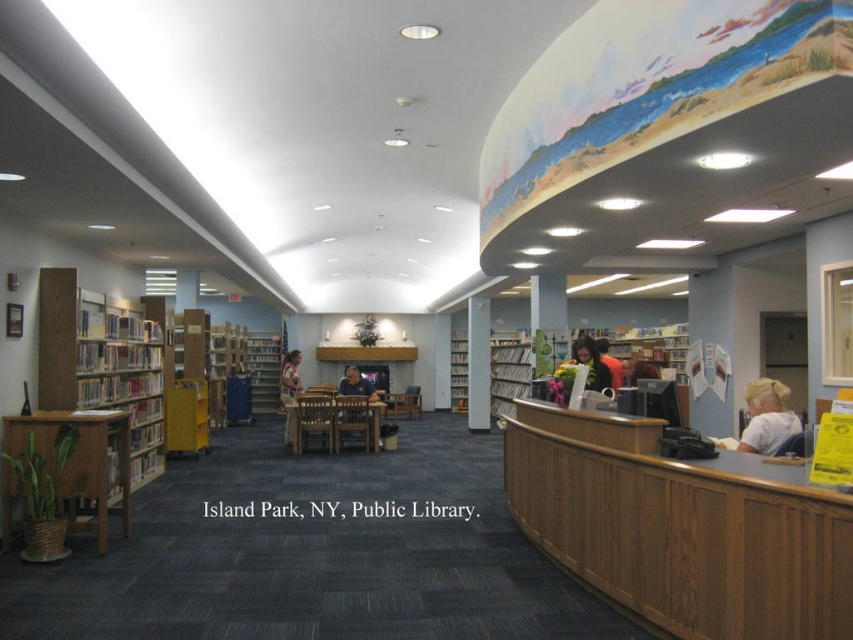
You are a visitor to the library and notice two items in the scene. One is the white matte shirt at lower right and the other is the smooth brown hair at center. Which item is positioned lower in the image?

The white matte shirt at lower right is positioned lower than the smooth brown hair at center.

You are a visitor standing in the library and want to place a tall plant between the wooden bookshelf at left and the white glossy pillar at center. Can you do this?

The wooden bookshelf at left is above the white glossy pillar at center, so there is no space between them for placing a tall plant.